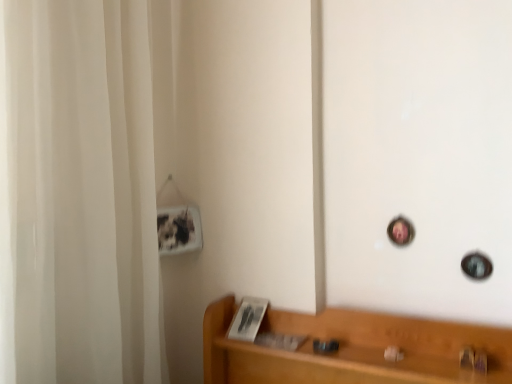
Question: Is metallic gold door handle at lower right located outside light brown wood shelf at lower right?

Choices:
 (A) yes
 (B) no

Answer: (A)

Question: From a real-world perspective, does metallic gold door handle at lower right sit lower than light brown wood shelf at lower right?

Choices:
 (A) no
 (B) yes

Answer: (A)

Question: Could you tell me if metallic gold door handle at lower right is facing light brown wood shelf at lower right?

Choices:
 (A) no
 (B) yes

Answer: (A)

Question: From a real-world perspective, is metallic gold door handle at lower right located higher than light brown wood shelf at lower right?

Choices:
 (A) yes
 (B) no

Answer: (A)

Question: Is metallic gold door handle at lower right wider than light brown wood shelf at lower right?

Choices:
 (A) yes
 (B) no

Answer: (B)

Question: Does metallic gold door handle at lower right have a lesser width compared to light brown wood shelf at lower right?

Choices:
 (A) no
 (B) yes

Answer: (B)

Question: Does light brown wood shelf at lower right have a lesser width compared to metallic gold door handle at lower right?

Choices:
 (A) yes
 (B) no

Answer: (B)

Question: Considering the relative sizes of light brown wood shelf at lower right and metallic gold door handle at lower right in the image provided, is light brown wood shelf at lower right taller than metallic gold door handle at lower right?

Choices:
 (A) no
 (B) yes

Answer: (B)

Question: From the image's perspective, would you say light brown wood shelf at lower right is positioned over metallic gold door handle at lower right?

Choices:
 (A) no
 (B) yes

Answer: (A)

Question: From a real-world perspective, is light brown wood shelf at lower right positioned over metallic gold door handle at lower right based on gravity?

Choices:
 (A) no
 (B) yes

Answer: (A)

Question: Considering the relative sizes of light brown wood shelf at lower right and metallic gold door handle at lower right in the image provided, is light brown wood shelf at lower right shorter than metallic gold door handle at lower right?

Choices:
 (A) no
 (B) yes

Answer: (A)

Question: Does light brown wood shelf at lower right have a larger size compared to metallic gold door handle at lower right?

Choices:
 (A) yes
 (B) no

Answer: (A)

Question: Is white fabric shower curtain at left taller than light brown wood shelf at lower right?

Choices:
 (A) no
 (B) yes

Answer: (B)